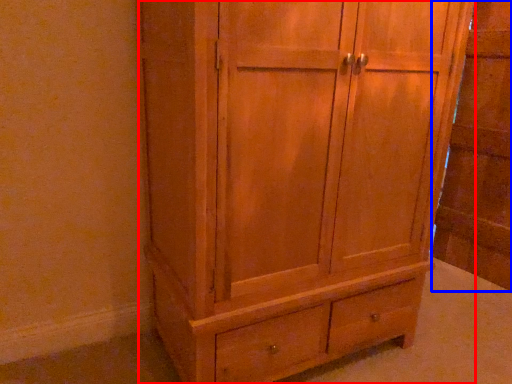
Question: Among these objects, which one is nearest to the camera, cupboard (highlighted by a red box) or side cabinet (highlighted by a blue box)?

Choices:
 (A) cupboard
 (B) side cabinet

Answer: (A)